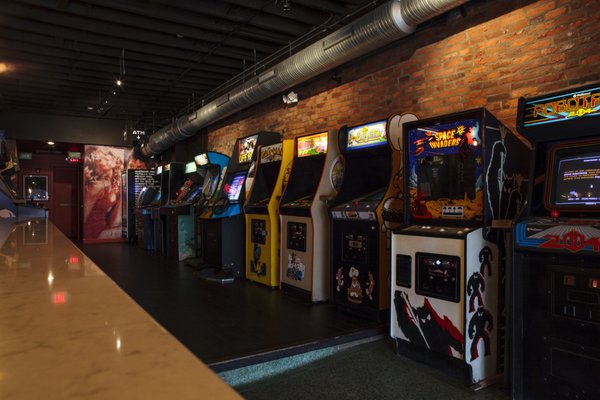
Locate an element on the screen. window is located at coordinates (37, 187).